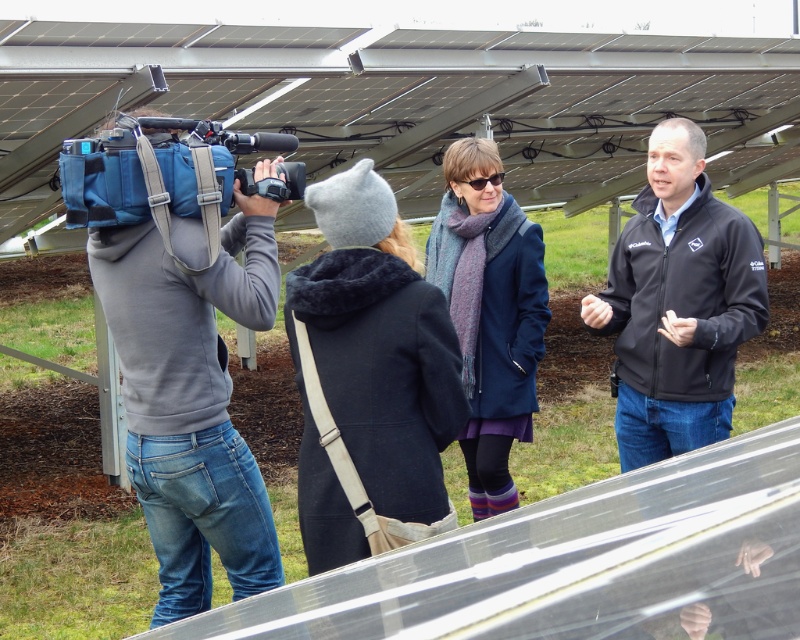
You are standing at the point labeled point [494,180] and want to walk to the point labeled point [318,529]. Which direction should you move in relation to the scene?

You should move forward because point [318,529] is in front of point [494,180].

You are standing at the point marked as point (x=456, y=417) in the image. You want to walk directly towards the viewer. How far will you have to walk to reach the viewer?

You will have to walk 11.24 feet to reach the viewer because the point (x=456, y=417) and viewer are 11.24 feet apart.